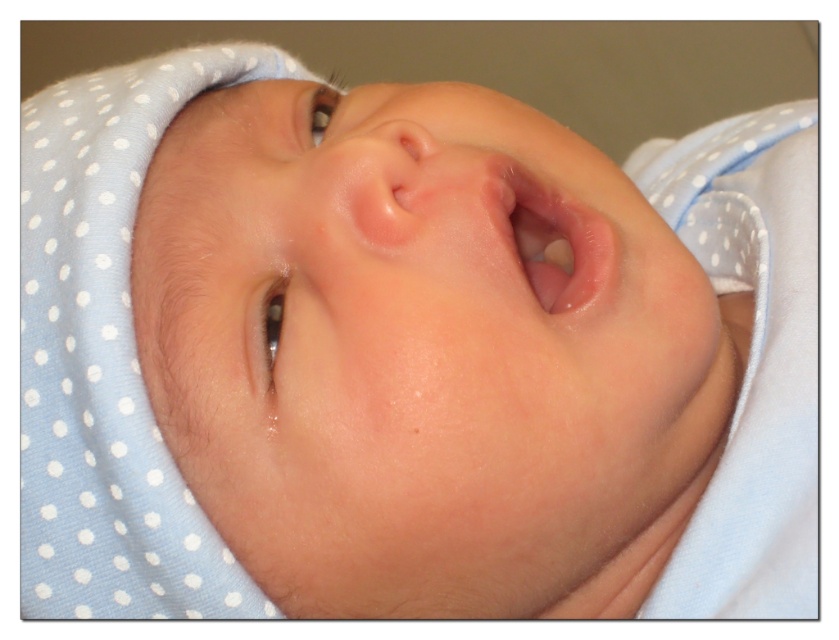
Does point (199, 160) come farther from viewer compared to point (511, 241)?

Yes, point (199, 160) is farther from viewer.

Is smooth skin face at center thinner than smooth flesh-colored mouth at center?

In fact, smooth skin face at center might be wider than smooth flesh-colored mouth at center.

Where is `smooth skin face at center`? The height and width of the screenshot is (640, 839). smooth skin face at center is located at coordinates (423, 353).